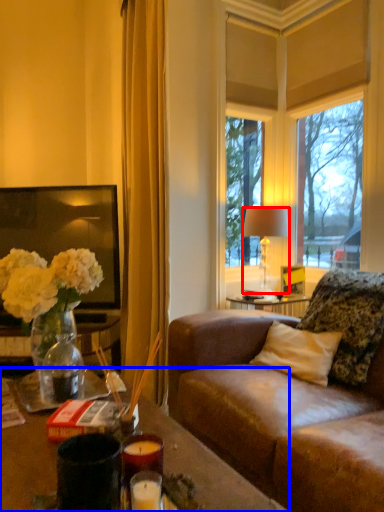
Question: Which point is closer to the camera, lamp (highlighted by a red box) or desk (highlighted by a blue box)?

Choices:
 (A) lamp
 (B) desk

Answer: (B)